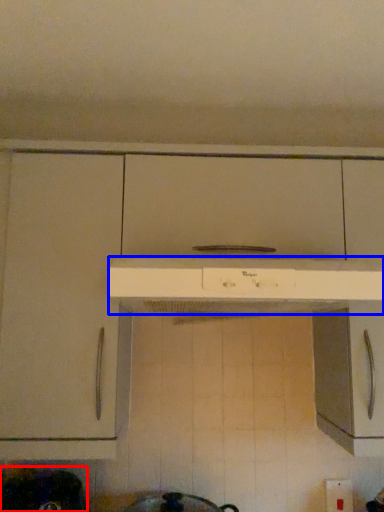
Question: Which of the following is the farthest to the observer, appliance (highlighted by a red box) or home appliance (highlighted by a blue box)?

Choices:
 (A) appliance
 (B) home appliance

Answer: (A)